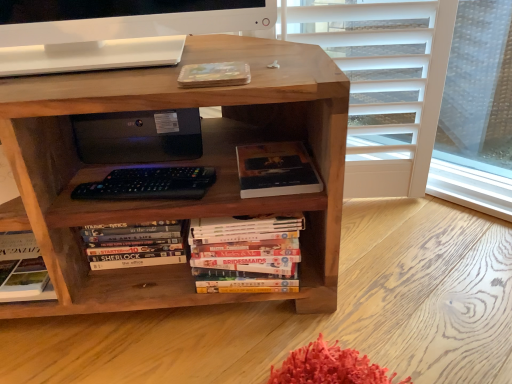
Question: From a real-world perspective, does hardcover book at center, marked as the first book in a right-to-left arrangement, stand above brown wood bookcase at center?

Choices:
 (A) yes
 (B) no

Answer: (A)

Question: From a real-world perspective, is hardcover book at center, marked as the first book in a right-to-left arrangement, positioned under brown wood bookcase at center based on gravity?

Choices:
 (A) yes
 (B) no

Answer: (B)

Question: Is hardcover book at center, the 3th book when ordered from left to right, outside brown wood bookcase at center?

Choices:
 (A) no
 (B) yes

Answer: (A)

Question: From the image's perspective, is hardcover book at center, the 3th book when ordered from left to right, beneath brown wood bookcase at center?

Choices:
 (A) no
 (B) yes

Answer: (B)

Question: Is hardcover book at center, the 3th book when ordered from left to right, closer to camera compared to brown wood bookcase at center?

Choices:
 (A) no
 (B) yes

Answer: (A)

Question: Is hardcover book at center, the 3th book when ordered from left to right, thinner than brown wood bookcase at center?

Choices:
 (A) no
 (B) yes

Answer: (B)

Question: Does black matte computer at center come behind hardcover book at center, the 3th book when ordered from left to right?

Choices:
 (A) yes
 (B) no

Answer: (A)

Question: Can you confirm if black matte computer at center is taller than hardcover book at center, marked as the first book in a right-to-left arrangement?

Choices:
 (A) yes
 (B) no

Answer: (A)

Question: Is black matte computer at center positioned far away from hardcover book at center, marked as the first book in a right-to-left arrangement?

Choices:
 (A) no
 (B) yes

Answer: (A)

Question: Considering the relative positions of black matte computer at center and hardcover book at center, marked as the first book in a right-to-left arrangement, in the image provided, is black matte computer at center to the left of hardcover book at center, marked as the first book in a right-to-left arrangement, from the viewer's perspective?

Choices:
 (A) yes
 (B) no

Answer: (A)

Question: Can you confirm if black matte computer at center is wider than hardcover book at center, marked as the first book in a right-to-left arrangement?

Choices:
 (A) yes
 (B) no

Answer: (A)

Question: Can hardcover book at center, marked as the first book in a right-to-left arrangement, be found inside black matte computer at center?

Choices:
 (A) no
 (B) yes

Answer: (A)

Question: Is the position of brown wood bookcase at center more distant than that of hardcover book at center, the 1th book positioned from the left?

Choices:
 (A) no
 (B) yes

Answer: (A)